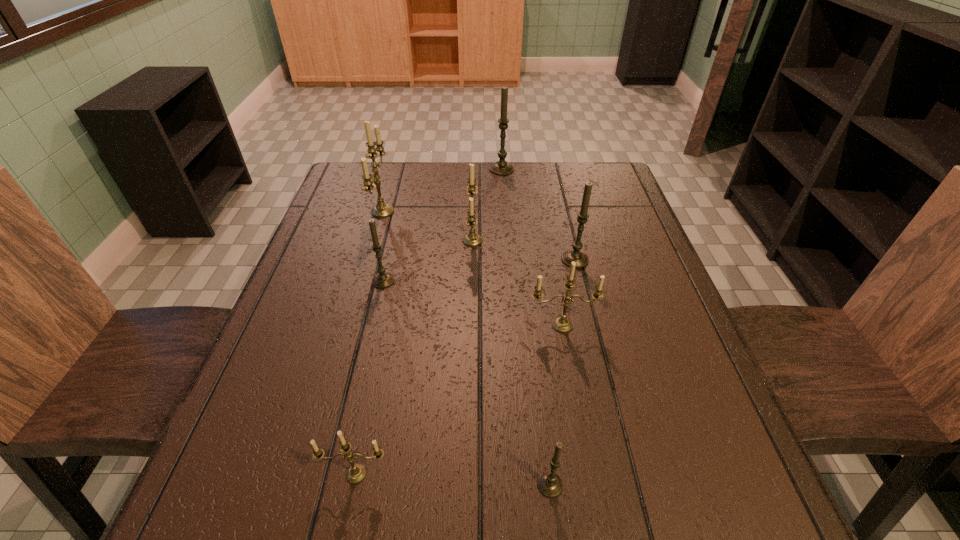
You are a GUI agent. You are given a task and a screenshot of the screen. Output one action in this format:
    pyautogui.click(x=<x>, y=<y>)
    Task: Click on the vacant space situated 0.340m on the back of the smallest metallic candle
    The height and width of the screenshot is (540, 960).
    Given the screenshot: What is the action you would take?
    pyautogui.click(x=389, y=313)

Identify the location of object that is positioned at the near edge. This screenshot has width=960, height=540. (549, 483).

Find the location of a particular element. object present at the left edge is located at coordinates (381, 210).

The height and width of the screenshot is (540, 960). I want to click on object at the far left corner, so click(x=381, y=210).

Find the location of a particular element. This screenshot has width=960, height=540. vacant space at the far edge of the desktop is located at coordinates point(387,197).

Where is `vacant space at the left edge`? vacant space at the left edge is located at coordinates (360, 226).

Image resolution: width=960 pixels, height=540 pixels. I want to click on free space at the right edge, so click(x=647, y=311).

In the image, there is a desktop. Identify the location of vacant space at the far left corner. The height and width of the screenshot is (540, 960). (352, 190).

You are a GUI agent. You are given a task and a screenshot of the screen. Output one action in this format:
    pyautogui.click(x=<x>, y=<y>)
    Task: Click on the free space at the far right corner of the desktop
    
    Given the screenshot: What is the action you would take?
    pyautogui.click(x=624, y=187)

Find the location of a particular element. This screenshot has width=960, height=540. unoccupied area between the leftmost gray candle and the second biggest metallic candle is located at coordinates (428, 261).